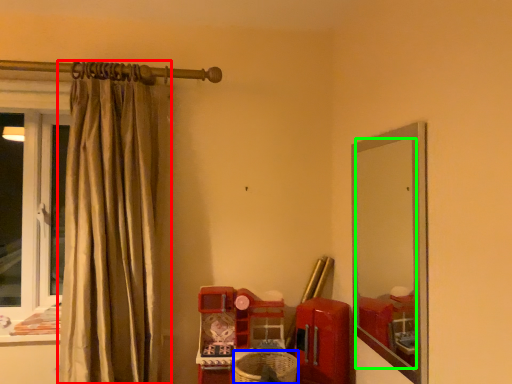
Question: Considering the real-world distances, which object is farthest from curtain (highlighted by a red box)? basket (highlighted by a blue box) or mirror (highlighted by a green box)?

Choices:
 (A) basket
 (B) mirror

Answer: (B)